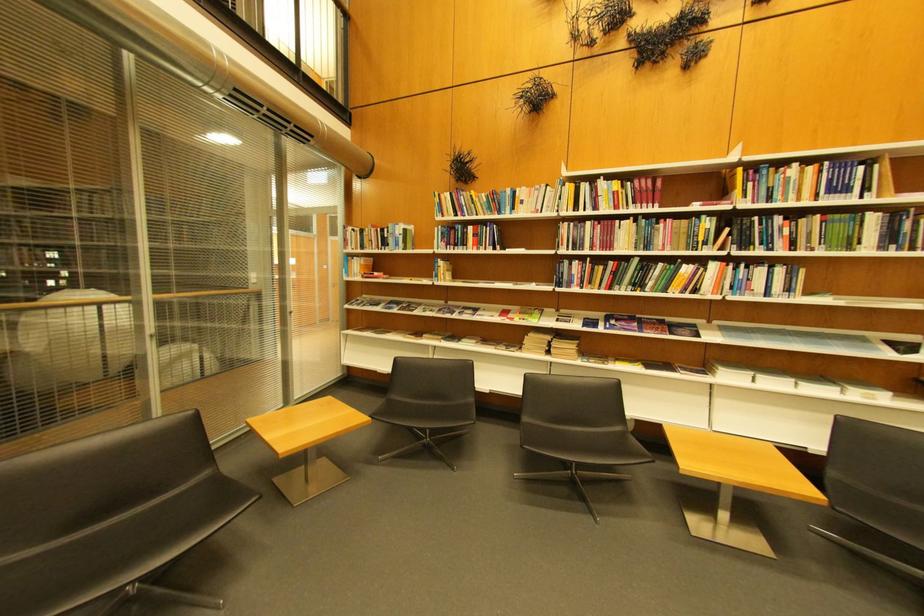
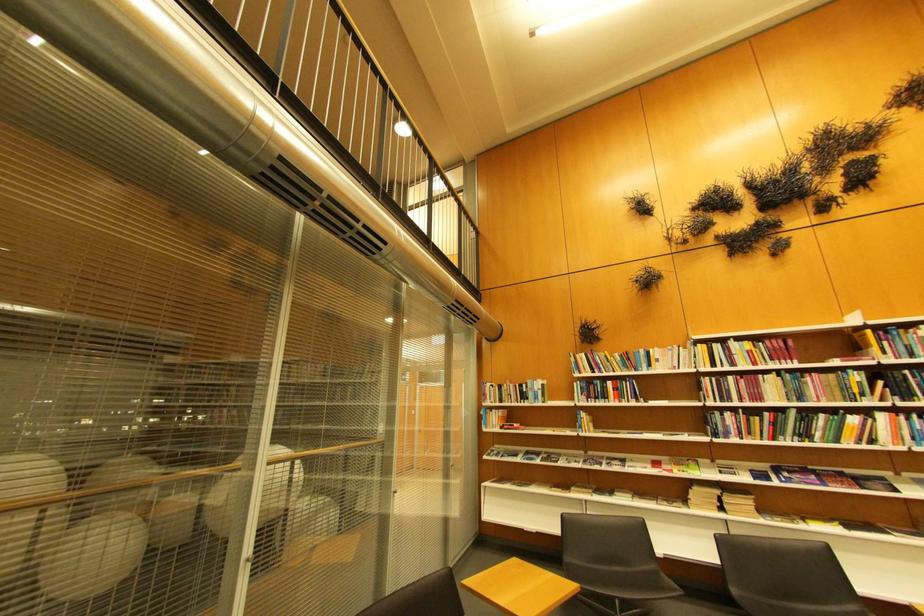
Locate, in the second image, the point that corresponds to [400,227] in the first image.

(540, 383)